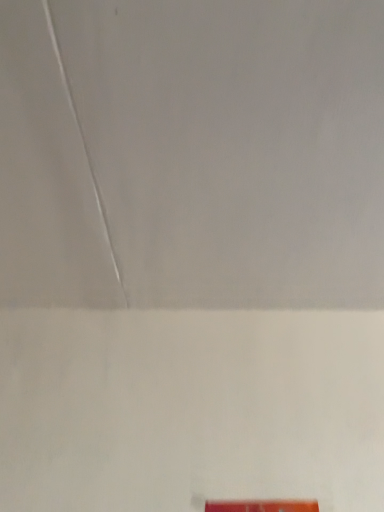
Question: Should I look upward or downward to see orange glossy sign at lower right?

Choices:
 (A) down
 (B) up

Answer: (A)